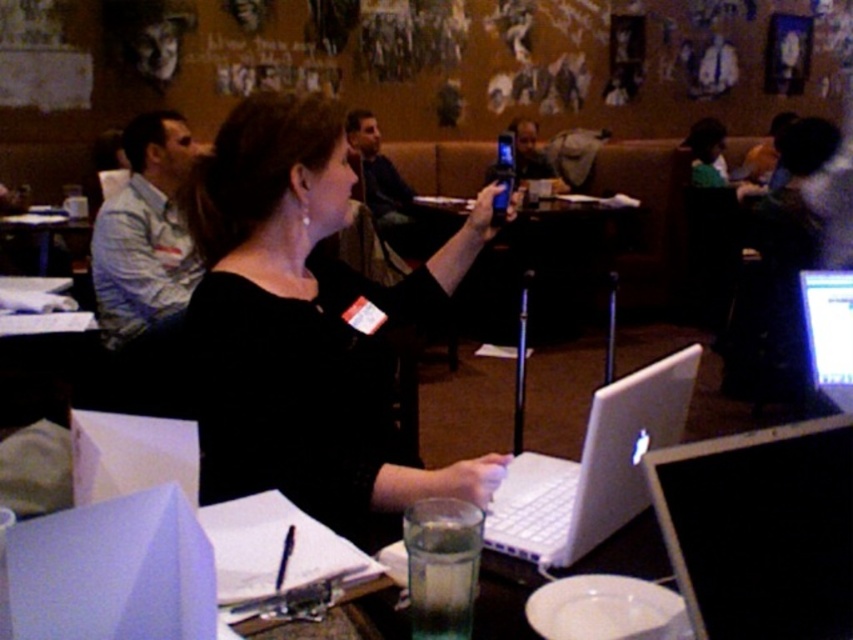
Question: Can you confirm if white shirt at left is smaller than matte black phone at center?

Choices:
 (A) yes
 (B) no

Answer: (A)

Question: Which point appears farthest from the camera in this image?

Choices:
 (A) (550, 180)
 (B) (569, 500)
 (C) (848, 352)
 (D) (142, 157)

Answer: (A)

Question: Does white glossy laptop at center appear on the left side of matte black phone at center?

Choices:
 (A) no
 (B) yes

Answer: (A)

Question: Can you confirm if white matte laptop at center is positioned above white glossy laptop at center?

Choices:
 (A) no
 (B) yes

Answer: (A)

Question: Which object appears closest to the camera in this image?

Choices:
 (A) white glossy laptop at center
 (B) white matte laptop at center
 (C) black matte shirt at center

Answer: (B)

Question: Which of the following is the farthest from the observer?

Choices:
 (A) (838, 628)
 (B) (546, 164)
 (C) (844, 332)

Answer: (B)